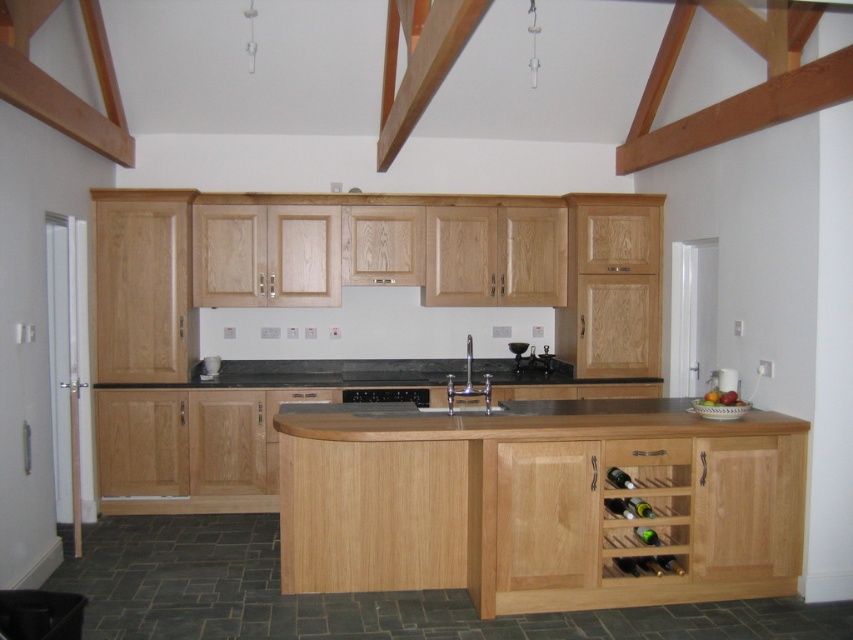
Question: Can you confirm if natural wood countertop at center is positioned above green glass wine bottle at lower right?

Choices:
 (A) yes
 (B) no

Answer: (A)

Question: Estimate the real-world distances between objects in this image. Which object is farther from the wooden wine rack at lower right?

Choices:
 (A) black matte oven at center
 (B) satin nickel faucet at center
 (C) green glass wine bottle at lower center

Answer: (A)

Question: Is green glass wine bottle at lower center wider than green glass wine bottle at lower right?

Choices:
 (A) yes
 (B) no

Answer: (A)

Question: Is wooden wine rack at lower right further to the viewer compared to satin nickel faucet at center?

Choices:
 (A) yes
 (B) no

Answer: (B)

Question: Which object is farther from the camera taking this photo?

Choices:
 (A) satin nickel faucet at center
 (B) wooden wine rack at lower right
 (C) green glass wine bottle at lower center

Answer: (A)

Question: Which point is farther from the camera taking this photo?

Choices:
 (A) (651, 541)
 (B) (625, 500)

Answer: (B)